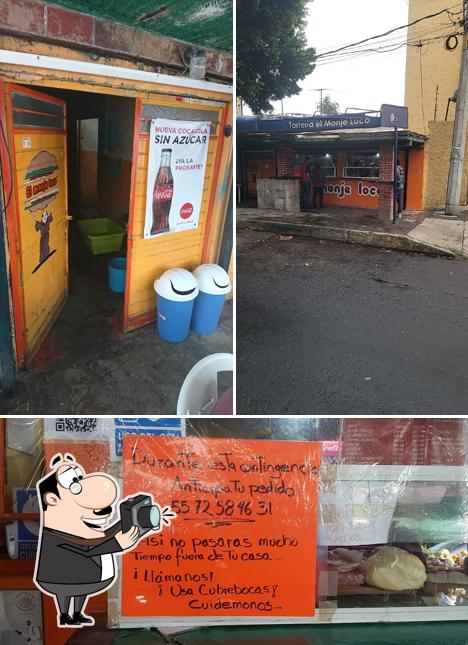
Identify the location of doorway. (85, 243).